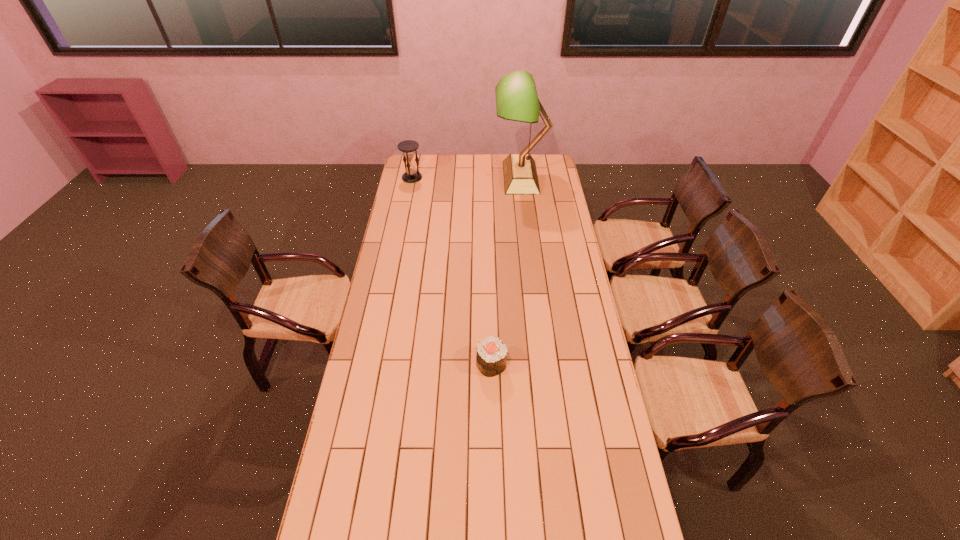
You are a GUI agent. You are given a task and a screenshot of the screen. Output one action in this format:
    pyautogui.click(x=<x>, y=<y>)
    Task: Click on the free point between the hourglass and the table lamp
    
    Given the screenshot: What is the action you would take?
    pyautogui.click(x=467, y=178)

Locate an element on the screen. The image size is (960, 540). vacant area between the sushi and the leftmost object is located at coordinates (452, 271).

You are a GUI agent. You are given a task and a screenshot of the screen. Output one action in this format:
    pyautogui.click(x=<x>, y=<y>)
    Task: Click on the vacant area that lies between the leftmost object and the tallest object
    The height and width of the screenshot is (540, 960).
    Given the screenshot: What is the action you would take?
    pyautogui.click(x=467, y=178)

I want to click on free space between the tallest object and the hourglass, so click(467, 178).

This screenshot has height=540, width=960. What are the coordinates of `free space between the tallest object and the nearest object` in the screenshot? It's located at (506, 271).

Locate an element on the screen. The image size is (960, 540). vacant point located between the shortest object and the hourglass is located at coordinates (452, 271).

Image resolution: width=960 pixels, height=540 pixels. I want to click on free area in between the table lamp and the leftmost object, so click(x=467, y=178).

Locate an element on the screen. This screenshot has width=960, height=540. free space that is in between the sushi and the tallest object is located at coordinates (506, 271).

Identify the location of vacant area between the table lamp and the shortest object. (506, 271).

Where is `the second closest object to the sushi`? Image resolution: width=960 pixels, height=540 pixels. the second closest object to the sushi is located at coordinates (409, 147).